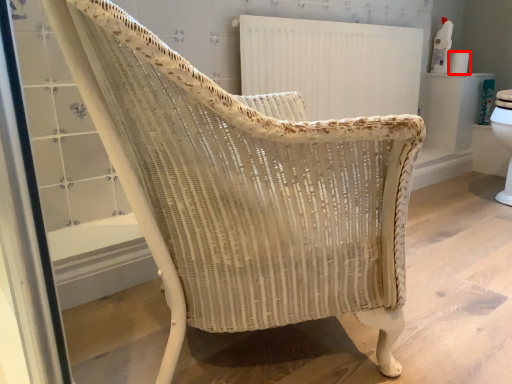
Question: From the image's perspective, what is the correct spatial positioning of toilet paper (annotated by the red box) in reference to radiator?

Choices:
 (A) above
 (B) below

Answer: (A)